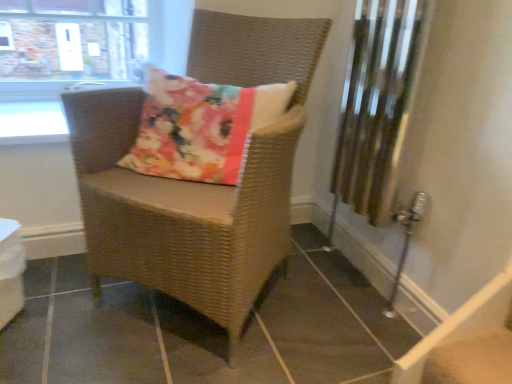
Question: Would you say woven brown chair at center is outside clear glass window at upper left?

Choices:
 (A) no
 (B) yes

Answer: (B)

Question: Is woven brown chair at center further to the viewer compared to clear glass window at upper left?

Choices:
 (A) no
 (B) yes

Answer: (A)

Question: Does woven brown chair at center have a lesser height compared to clear glass window at upper left?

Choices:
 (A) no
 (B) yes

Answer: (A)

Question: Can you confirm if woven brown chair at center is thinner than clear glass window at upper left?

Choices:
 (A) yes
 (B) no

Answer: (B)

Question: Can clear glass window at upper left be found inside woven brown chair at center?

Choices:
 (A) yes
 (B) no

Answer: (B)

Question: In terms of size, does white glossy window sill at upper left appear bigger or smaller than clear glass window at upper left?

Choices:
 (A) big
 (B) small

Answer: (B)

Question: Considering the positions of white glossy window sill at upper left and clear glass window at upper left in the image, is white glossy window sill at upper left taller or shorter than clear glass window at upper left?

Choices:
 (A) short
 (B) tall

Answer: (A)

Question: From the image's perspective, is white glossy window sill at upper left positioned above or below clear glass window at upper left?

Choices:
 (A) above
 (B) below

Answer: (B)

Question: Is white glossy window sill at upper left wider or thinner than clear glass window at upper left?

Choices:
 (A) thin
 (B) wide

Answer: (B)

Question: Considering the relative positions of white glossy table at lower left and white glossy window sill at upper left in the image provided, is white glossy table at lower left to the left or to the right of white glossy window sill at upper left?

Choices:
 (A) left
 (B) right

Answer: (B)

Question: Is white glossy table at lower left in front of or behind white glossy window sill at upper left in the image?

Choices:
 (A) behind
 (B) front

Answer: (B)

Question: From the image's perspective, is white glossy table at lower left positioned above or below white glossy window sill at upper left?

Choices:
 (A) above
 (B) below

Answer: (B)

Question: Considering the positions of white glossy table at lower left and white glossy window sill at upper left in the image, is white glossy table at lower left taller or shorter than white glossy window sill at upper left?

Choices:
 (A) short
 (B) tall

Answer: (B)

Question: Is white glossy window sill at upper left to the left or to the right of white glossy table at lower left in the image?

Choices:
 (A) right
 (B) left

Answer: (B)

Question: From a real-world perspective, relative to white glossy table at lower left, is white glossy window sill at upper left vertically above or below?

Choices:
 (A) above
 (B) below

Answer: (A)